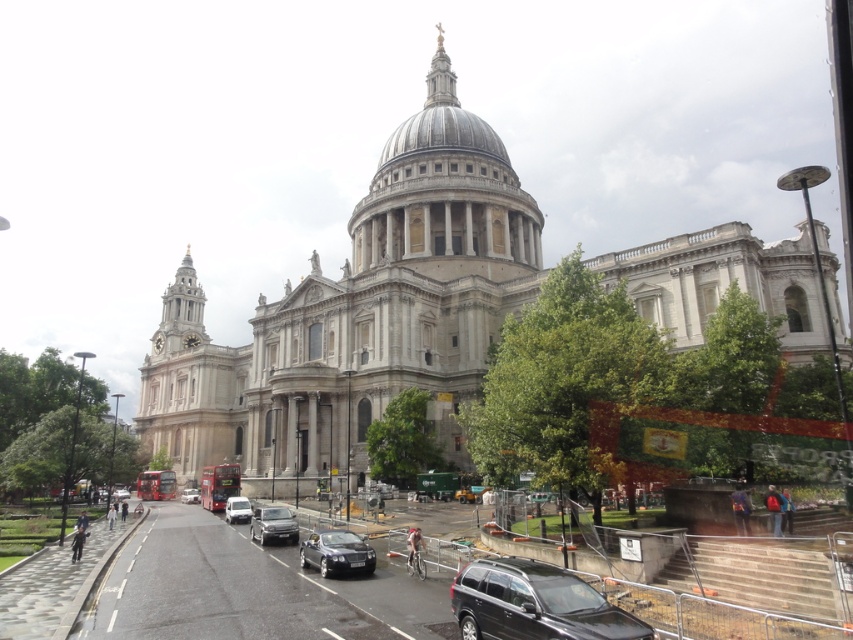
You are a delivery driver needing to park your metallic silver car at center near St. Paul Cathedral. The parking spot is at coordinate point 0.820, 0.321. Is your car already parked in the correct spot?

Yes, the metallic silver car at center is located at point (273, 524), so it is already parked in the correct spot.

You are a delivery person who needs to park your van between the shiny black car at center and the silver metallic car at center. The van is 20 feet long. Can you fit your van between them without moving either car?

The distance between the shiny black car at center and the silver metallic car at center is 134.80 feet. Since the van is only 20 feet long, there is more than enough space to park it between them without moving either car.

You are a delivery person needing to park your 1.8 meters tall motorcycle between the shiny black car at center and the silver metallic car at center. Can you fit your motorcycle between them?

The shiny black car at center is much taller than the silver metallic car at center. Since the motorcycle is 1.8 meters tall, it can fit between them as the height difference allows enough space.